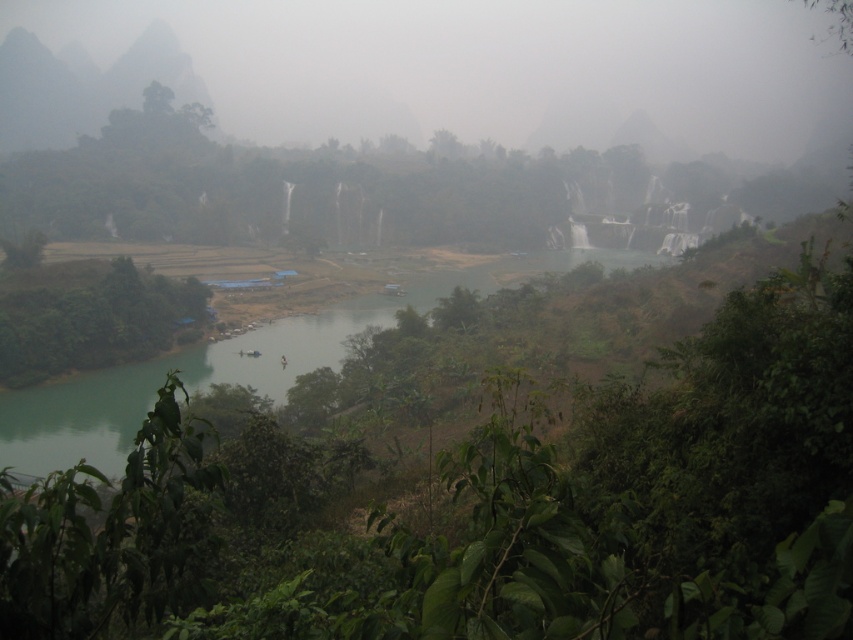
Between green leafy tree at center and gray rock mountain at upper left, which one is positioned lower?

green leafy tree at center is below.

Where is `green leafy tree at center`? The image size is (853, 640). green leafy tree at center is located at coordinates (486, 481).

Who is lower down, foggy mist at upper center or gray rock mountain at upper left?

gray rock mountain at upper left

Is foggy mist at upper center shorter than gray rock mountain at upper left?

In fact, foggy mist at upper center may be taller than gray rock mountain at upper left.

In order to click on foggy mist at upper center in this screenshot , I will do `click(490, 67)`.

Does green leafy tree at center have a lesser width compared to green leafy tree at lower left?

No, green leafy tree at center is not thinner than green leafy tree at lower left.

Based on the photo, does green leafy tree at center have a lesser height compared to green leafy tree at lower left?

No.

Between point (821, 632) and point (80, 284), which one is positioned in front?

Point (821, 632) is more forward.

The width and height of the screenshot is (853, 640). In order to click on green leafy tree at center in this screenshot , I will do `click(486, 481)`.